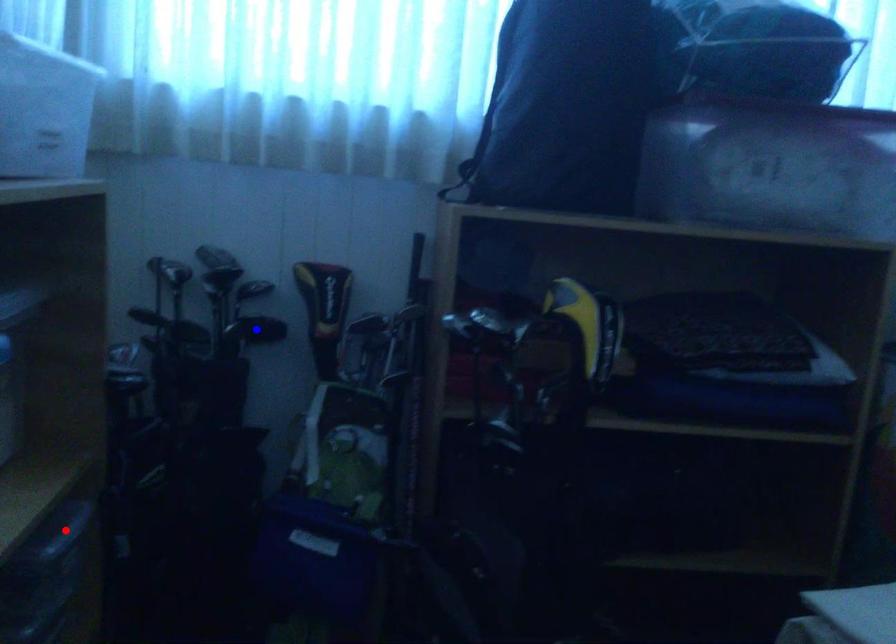
Question: In the image, two points are highlighted. Which point is nearer to the camera? Reply with the corresponding letter.

Choices:
 (A) blue point
 (B) red point

Answer: (B)